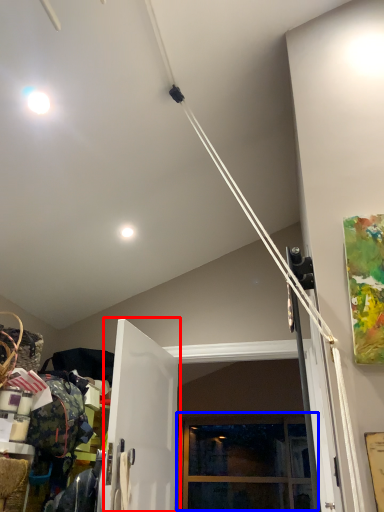
Question: Which point is further to the camera, door (highlighted by a red box) or window (highlighted by a blue box)?

Choices:
 (A) door
 (B) window

Answer: (B)